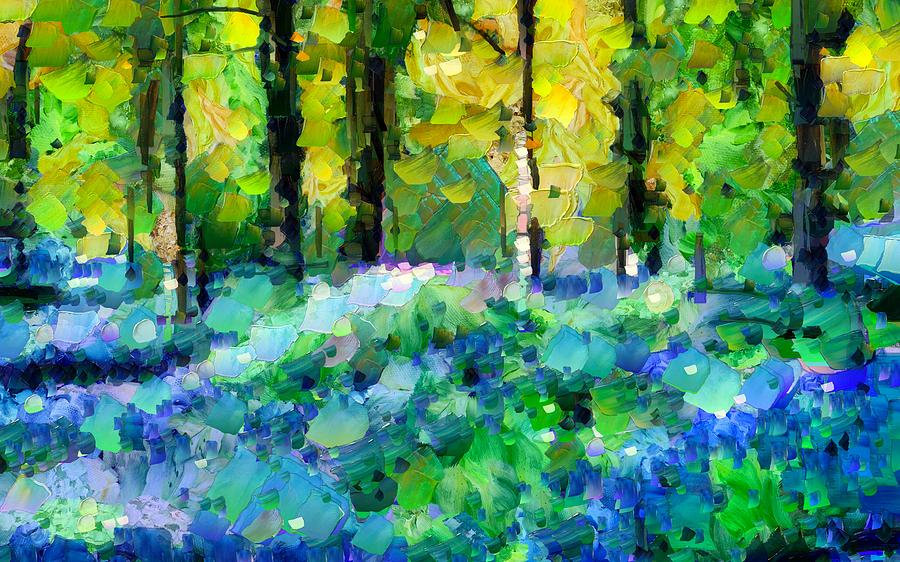
The width and height of the screenshot is (900, 562). In order to click on plant in this screenshot , I will do `click(767, 34)`.